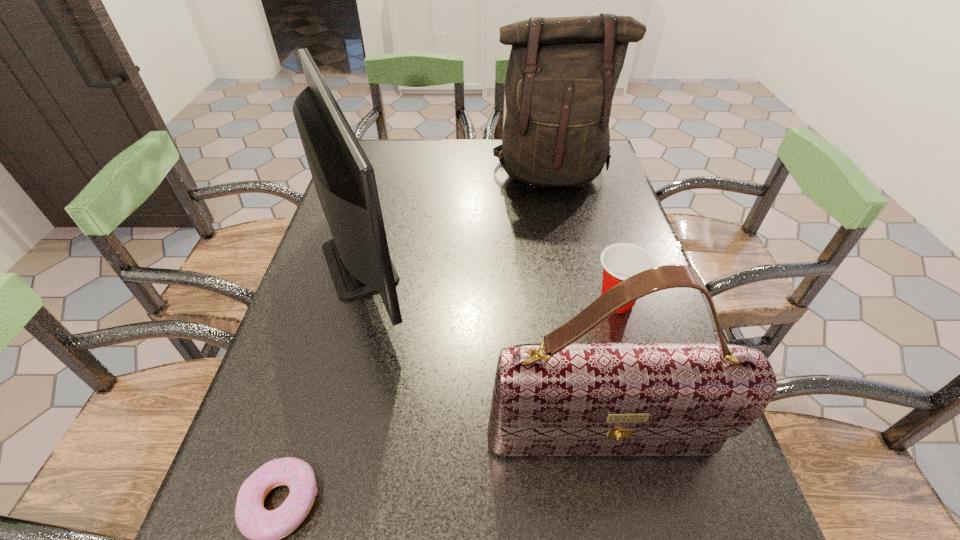
Find the location of a particular element. free space between the farthest object and the handbag is located at coordinates (576, 307).

The height and width of the screenshot is (540, 960). I want to click on free space between the backpack and the computer monitor, so click(x=459, y=218).

Select which object appears as the closest to the farthest object. Please provide its 2D coordinates. Your answer should be formatted as a tuple, i.e. [(x, y)], where the tuple contains the x and y coordinates of a point satisfying the conditions above.

[(358, 258)]

Identify which object is the nearest to the backpack. Please provide its 2D coordinates. Your answer should be formatted as a tuple, i.e. [(x, y)], where the tuple contains the x and y coordinates of a point satisfying the conditions above.

[(358, 258)]

What are the coordinates of `vacant space that satisfies the following two spatial constraints: 1. on the open flap of the second shortest object; 2. on the left side of the backpack` in the screenshot? It's located at (579, 301).

At what (x,y) coordinates should I click in order to perform the action: click on vacant space that satisfies the following two spatial constraints: 1. on the open flap of the backpack; 2. on the front-facing side of the computer monitor. Please return your answer as a coordinate pair (x, y). The image size is (960, 540). Looking at the image, I should click on (570, 261).

You are a GUI agent. You are given a task and a screenshot of the screen. Output one action in this format:
    pyautogui.click(x=<x>, y=<y>)
    Task: Click on the free space that satisfies the following two spatial constraints: 1. on the open flap of the farthest object; 2. on the left side of the cup
    Image resolution: width=960 pixels, height=540 pixels.
    Given the screenshot: What is the action you would take?
    pyautogui.click(x=579, y=301)

Where is `vacant area that satisfies the following two spatial constraints: 1. on the open flap of the cup; 2. on the right side of the backpack`? Image resolution: width=960 pixels, height=540 pixels. vacant area that satisfies the following two spatial constraints: 1. on the open flap of the cup; 2. on the right side of the backpack is located at coordinates pyautogui.click(x=579, y=301).